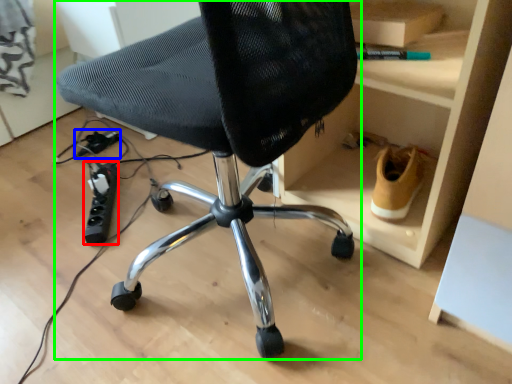
Question: Estimate the real-world distances between objects in this image. Which object is closer to plug (highlighted by a red box), plug (highlighted by a blue box) or chair (highlighted by a green box)?

Choices:
 (A) plug
 (B) chair

Answer: (A)